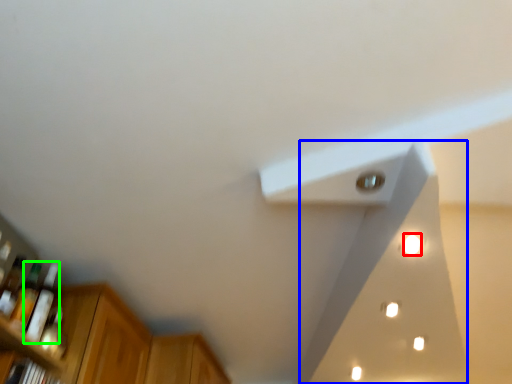
Question: Estimate the real-world distances between objects in this image. Which object is closer to light (highlighted by a red box), exhaust hood (highlighted by a blue box) or bottle (highlighted by a green box)?

Choices:
 (A) exhaust hood
 (B) bottle

Answer: (A)